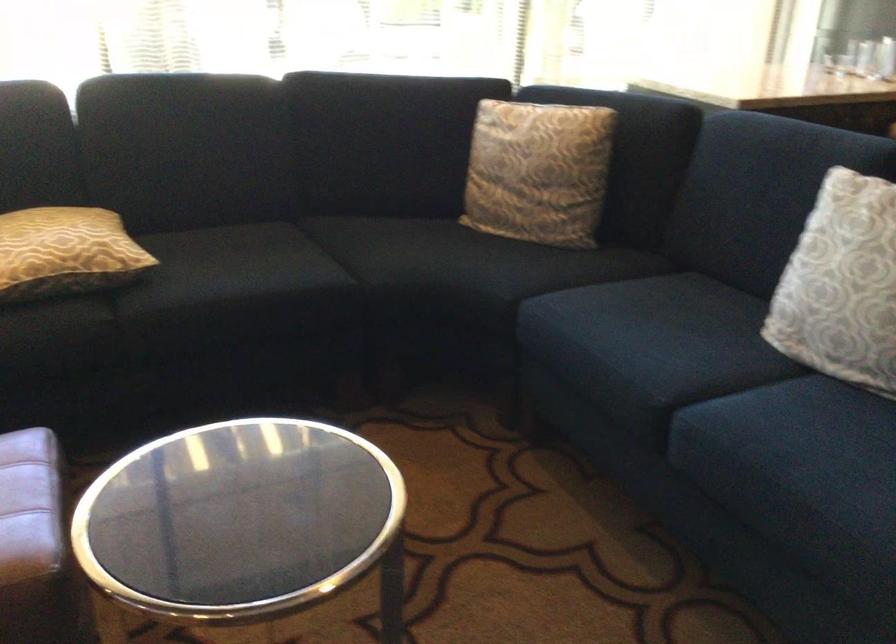
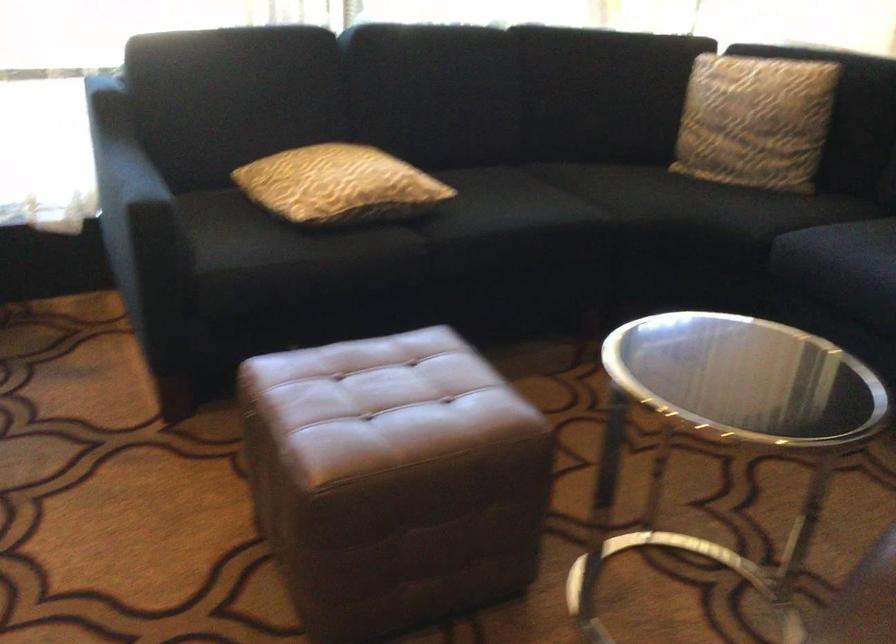
Locate, in the second image, the point that corresponds to point (528, 178) in the first image.

(754, 120)